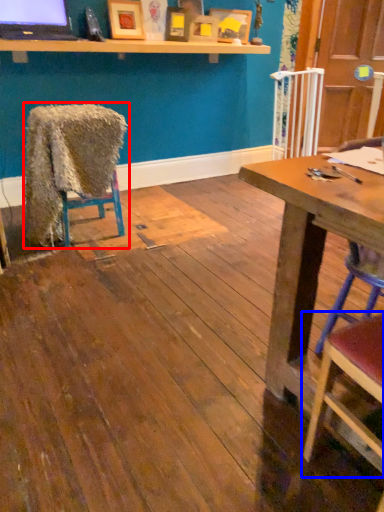
Question: Which point is closer to the camera, chair (highlighted by a red box) or chair (highlighted by a blue box)?

Choices:
 (A) chair
 (B) chair

Answer: (B)